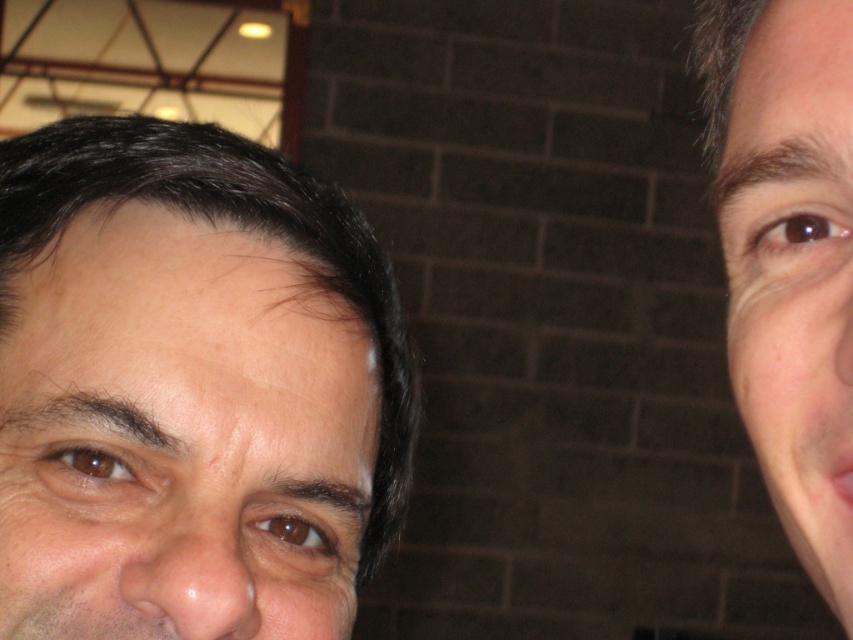
Question: Which point is closer to the camera taking this photo?

Choices:
 (A) (816, 340)
 (B) (231, 624)

Answer: (A)

Question: Does smooth skin face at left come in front of smooth skin face at right?

Choices:
 (A) no
 (B) yes

Answer: (A)

Question: Does smooth skin face at left appear on the right side of smooth skin face at right?

Choices:
 (A) yes
 (B) no

Answer: (B)

Question: Does smooth skin face at left appear on the left side of smooth skin face at right?

Choices:
 (A) no
 (B) yes

Answer: (B)